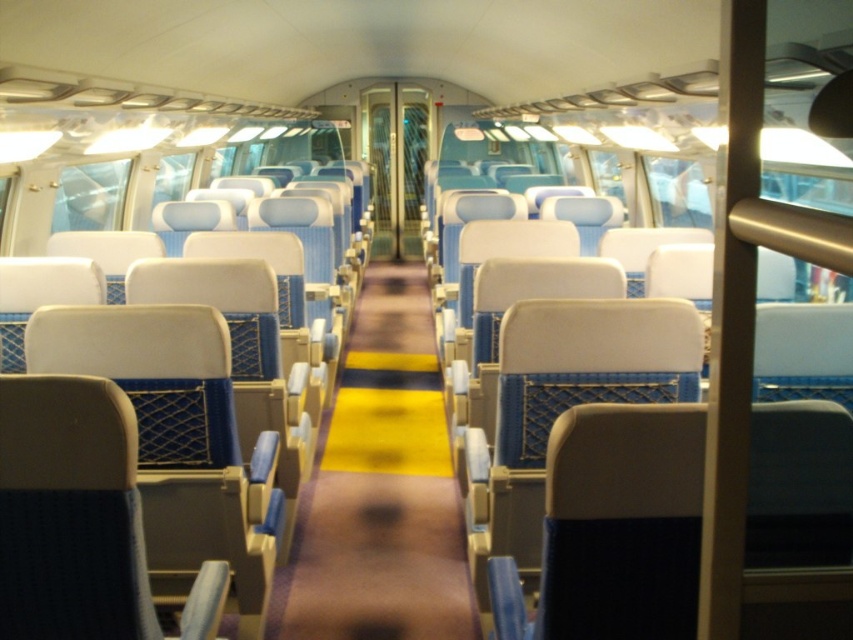
You are a passenger in the train carriage and need to place a small backpack on the seat. Which seat, the matte blue seat at center or the blue fabric seat at center, would allow the backpack to be placed higher up?

The matte blue seat at center is much taller than the blue fabric seat at center, so placing the backpack there would result in it being higher up.

You are a passenger trying to sit down in the train carriage. You notice two seats at the center of the carriage. Which one is narrower between the matte blue seat at center and the beige fabric chair at center?

The matte blue seat at center is thinner than the beige fabric chair at center, so the matte blue seat at center is narrower.